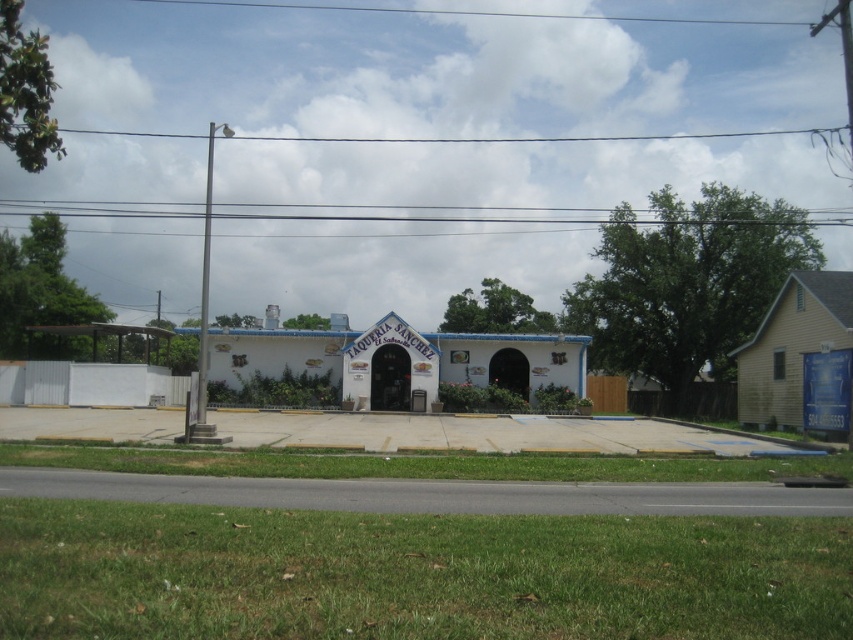
Question: Is white stucco building at center further to camera compared to yellow wood house at right?

Choices:
 (A) no
 (B) yes

Answer: (B)

Question: Observing the image, what is the correct spatial positioning of white stucco building at center in reference to yellow wood house at right?

Choices:
 (A) below
 (B) above

Answer: (A)

Question: Is white stucco building at center positioned behind yellow wood house at right?

Choices:
 (A) yes
 (B) no

Answer: (A)